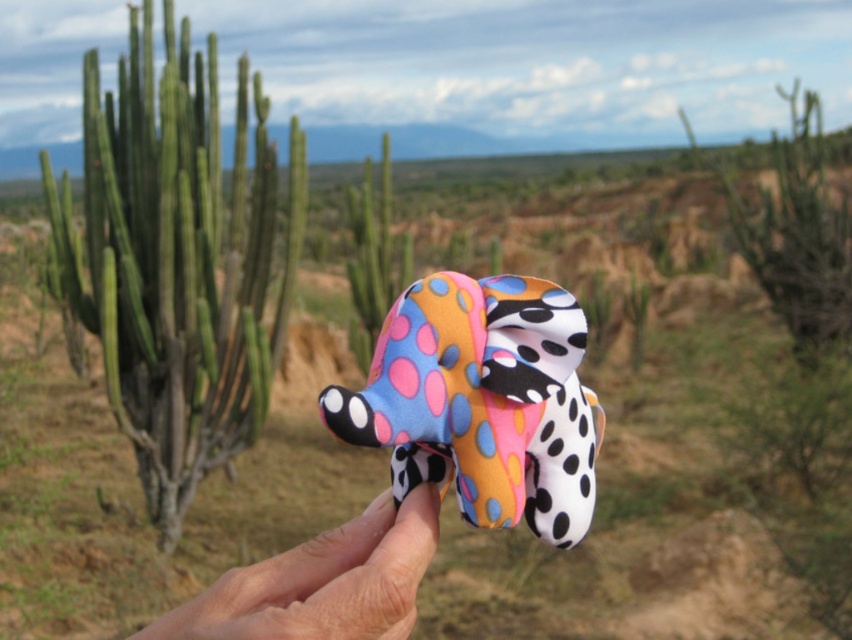
You are holding the polka dot fabric elephant at center in your smooth skin hand at center. Can you tell me which object is wider?

The polka dot fabric elephant at center is wider than the smooth skin hand at center.